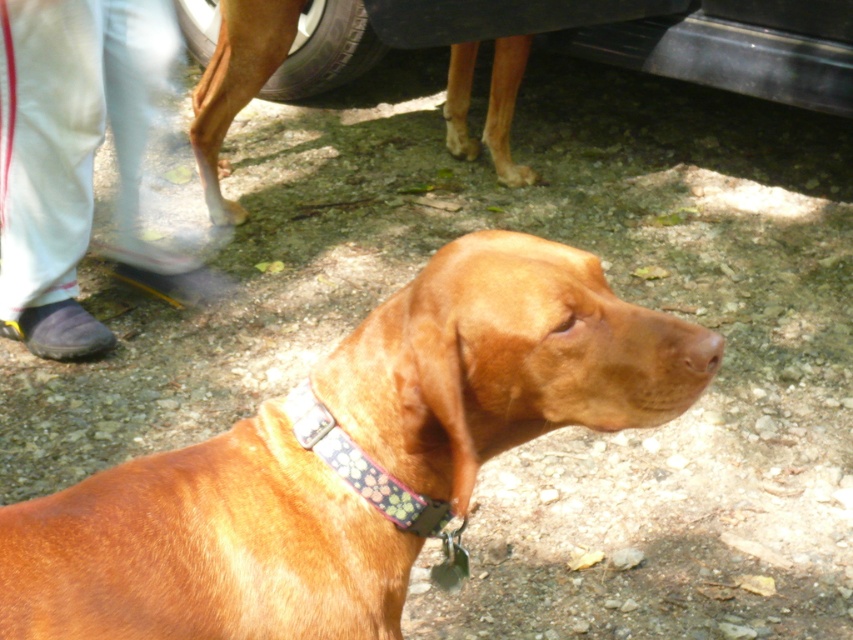
Does point (747, 36) come farther from viewer compared to point (701, 348)?

Yes, it is behind point (701, 348).

You are a GUI agent. You are given a task and a screenshot of the screen. Output one action in this format:
    pyautogui.click(x=<x>, y=<y>)
    Task: Click on the black rubber tire at upper center
    
    Given the screenshot: What is the action you would take?
    pyautogui.click(x=596, y=40)

Between black rubber tire at upper center and floral fabric collar at center, which one has less height?

Standing shorter between the two is floral fabric collar at center.

Is black rubber tire at upper center below floral fabric collar at center?

No, black rubber tire at upper center is not below floral fabric collar at center.

Does point (685, 42) lie behind point (444, 545)?

Yes, point (685, 42) is farther from viewer.

This screenshot has width=853, height=640. What are the coordinates of `black rubber tire at upper center` in the screenshot? It's located at pyautogui.click(x=596, y=40).

Does brown leather dog at upper center appear on the left side of brown matte nose at center?

Yes, brown leather dog at upper center is to the left of brown matte nose at center.

Can you confirm if brown leather dog at upper center is positioned to the right of brown matte nose at center?

No, brown leather dog at upper center is not to the right of brown matte nose at center.

I want to click on brown leather dog at upper center, so click(236, 84).